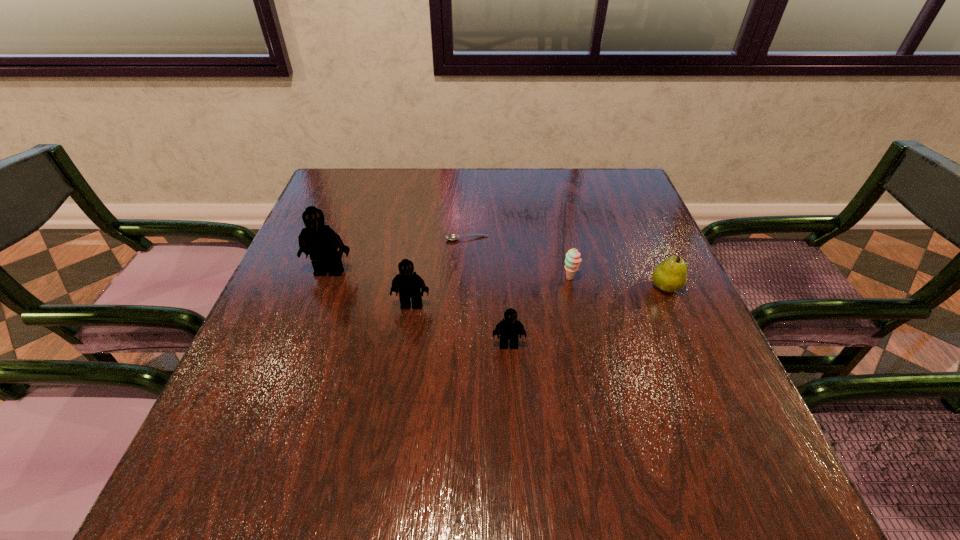
The height and width of the screenshot is (540, 960). I want to click on vacant space at the right edge of the desktop, so click(670, 345).

The height and width of the screenshot is (540, 960). I want to click on vacant space at the far left corner, so click(x=336, y=211).

Find the location of a particular element. unoccupied position between the tallest Lego and the second farthest Lego is located at coordinates 371,288.

At what (x,y) coordinates should I click in order to perform the action: click on vacant region between the fourth object from left to right and the second nearest Lego. Please return your answer as a coordinate pair (x, y). Image resolution: width=960 pixels, height=540 pixels. Looking at the image, I should click on (460, 325).

Where is `unoccupied position between the sherbert and the fourth object from right to left`? unoccupied position between the sherbert and the fourth object from right to left is located at coordinates (518, 258).

The image size is (960, 540). Find the location of `free spot between the pear and the fifth object from left to right`. free spot between the pear and the fifth object from left to right is located at coordinates (617, 282).

The width and height of the screenshot is (960, 540). Identify the location of vacant area between the pear and the third object from right to left. (588, 316).

Find the location of a particular element. This screenshot has height=540, width=960. free space between the rightmost object and the rightmost Lego is located at coordinates (588, 316).

Locate an element on the screen. free space between the shortest object and the nearest Lego is located at coordinates (488, 292).

Identify which object is the third closest to the rightmost object. Please provide its 2D coordinates. Your answer should be formatted as a tuple, i.e. [(x, y)], where the tuple contains the x and y coordinates of a point satisfying the conditions above.

[(452, 236)]